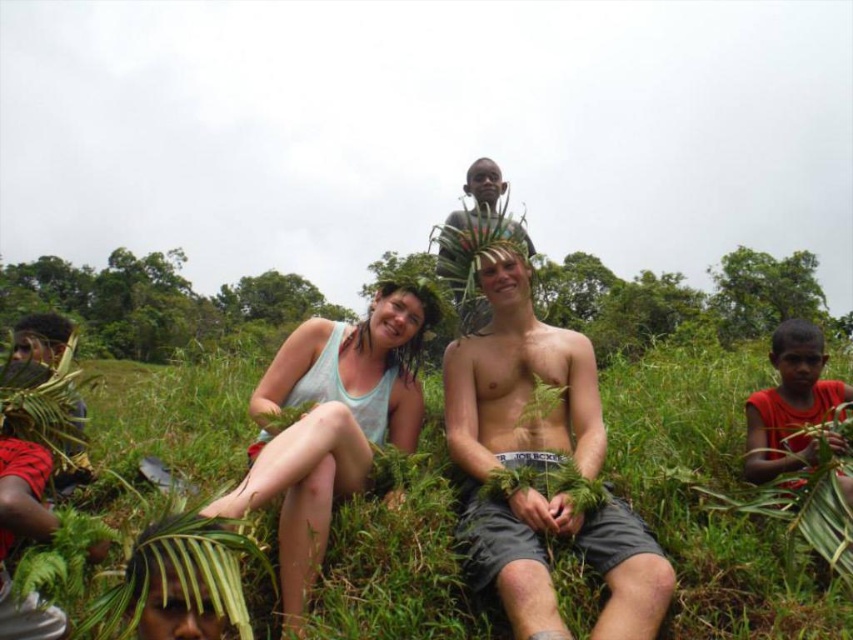
You are a photographer standing in the scene and want to capture both the green leafy grass at center and the smooth brown leaflet at upper center in your photo. Which object will appear larger in the photo?

The green leafy grass at center will appear larger in the photo because it is closer to the viewer than the smooth brown leaflet at upper center.

You are a photographer trying to capture a closeup of the smooth brown leaflet at upper center. The green leafy grass at center is blocking your view. Can you move the grass to get a clear shot?

The green leafy grass at center is bigger than smooth brown leaflet at upper center, so moving the grass might be necessary to get a clear shot of the leaflet.